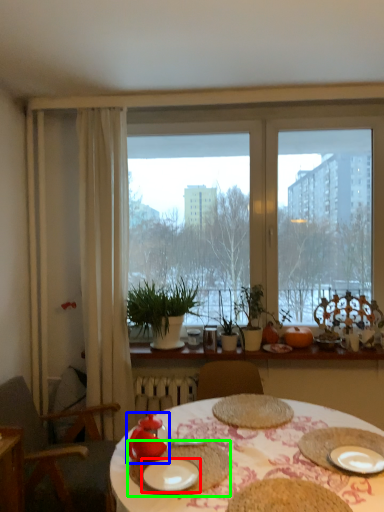
Question: Which object is positioned closest to plate (highlighted by a red box)? Select from tableware (highlighted by a blue box) and tableware (highlighted by a green box).

Choices:
 (A) tableware
 (B) tableware

Answer: (B)